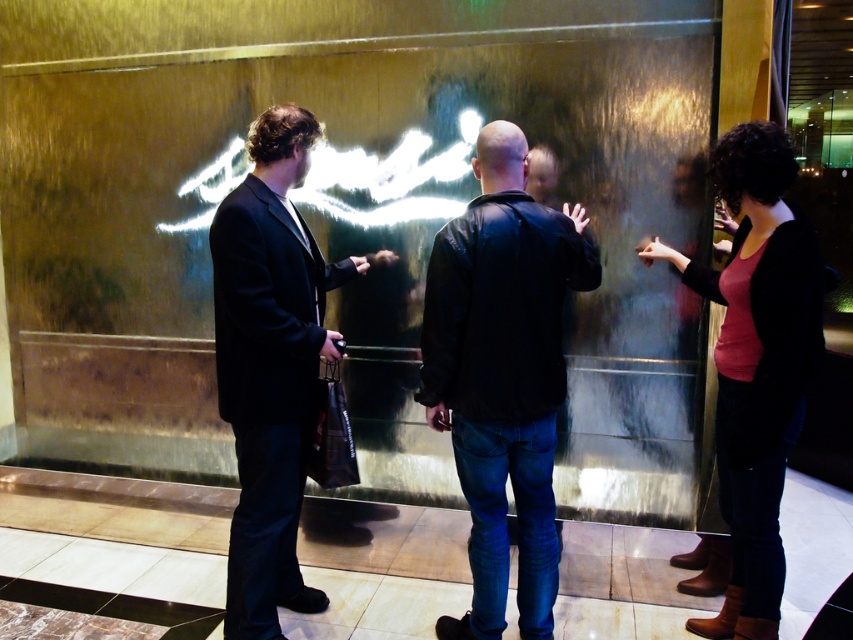
Question: Among these points, which one is nearest to the camera?

Choices:
 (A) (560, 339)
 (B) (280, 584)
 (C) (785, 452)

Answer: (C)

Question: Is matte black suit at left wider than matte black sweater at right?

Choices:
 (A) no
 (B) yes

Answer: (A)

Question: Based on their relative distances, which object is nearer to the matte black sweater at right?

Choices:
 (A) matte black suit at left
 (B) black leather jacket at center

Answer: (B)

Question: Can you confirm if black leather jacket at center is bigger than matte black suit at left?

Choices:
 (A) yes
 (B) no

Answer: (B)

Question: Considering the real-world distances, which object is closest to the matte black suit at left?

Choices:
 (A) matte black sweater at right
 (B) black leather jacket at center

Answer: (B)

Question: Does black leather jacket at center have a larger size compared to matte black suit at left?

Choices:
 (A) no
 (B) yes

Answer: (A)